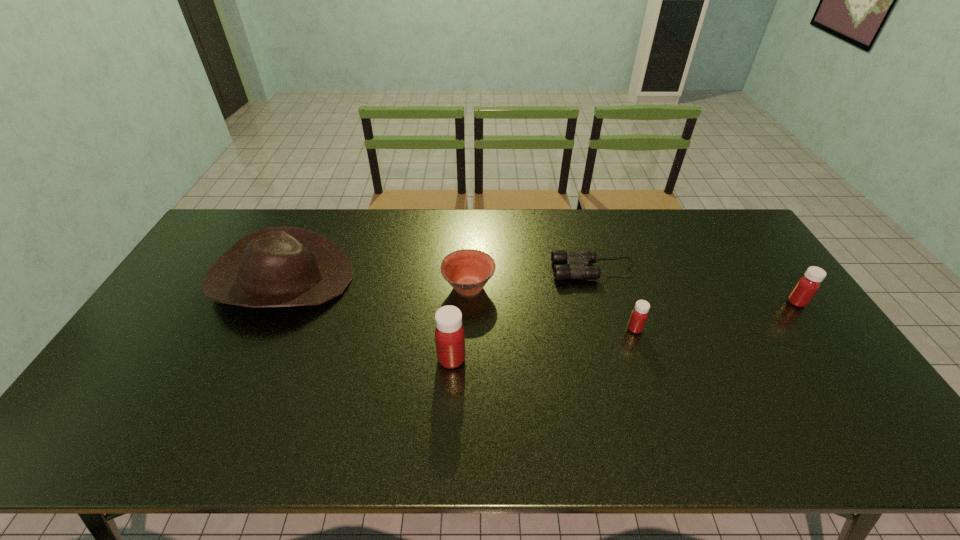
You are a GUI agent. You are given a task and a screenshot of the screen. Output one action in this format:
    pyautogui.click(x=<x>, y=<y>)
    Task: Click on the leftmost medicine
    This screenshot has height=540, width=960.
    Given the screenshot: What is the action you would take?
    pyautogui.click(x=449, y=334)

Locate an element on the screen. The height and width of the screenshot is (540, 960). the nearest medicine is located at coordinates (449, 334).

This screenshot has width=960, height=540. I want to click on the second medicine from right to left, so click(639, 315).

Image resolution: width=960 pixels, height=540 pixels. I want to click on the shortest medicine, so click(x=639, y=315).

The image size is (960, 540). Identify the location of the rightmost medicine. (806, 287).

Find the location of a particular element. This screenshot has width=960, height=540. the second shortest medicine is located at coordinates (806, 287).

Find the location of a particular element. This screenshot has height=540, width=960. binoculars is located at coordinates (577, 262).

The width and height of the screenshot is (960, 540). I want to click on bowl, so click(467, 271).

The image size is (960, 540). I want to click on cowboy hat, so tap(277, 266).

Locate an element on the screen. Image resolution: width=960 pixels, height=540 pixels. free space located on the left of the tallest medicine is located at coordinates (344, 359).